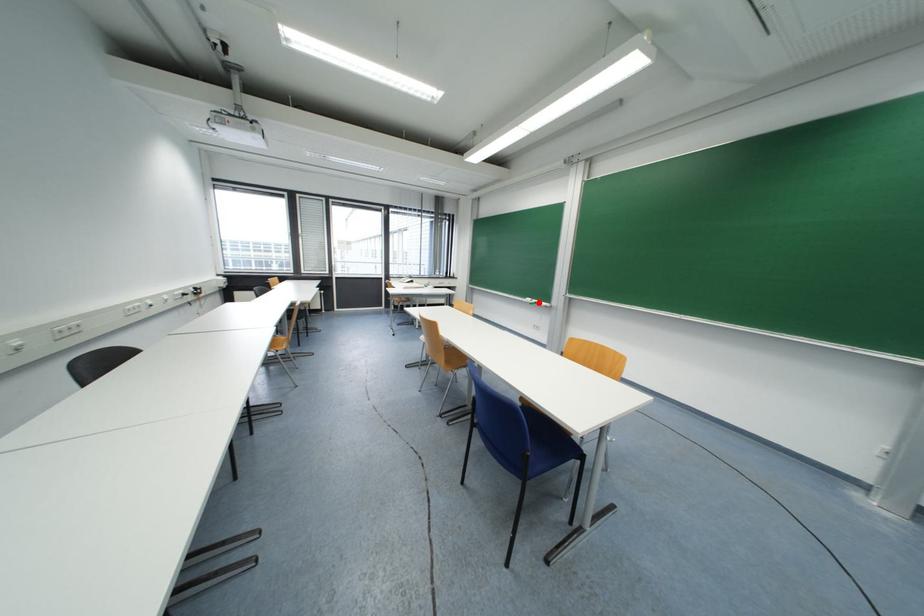
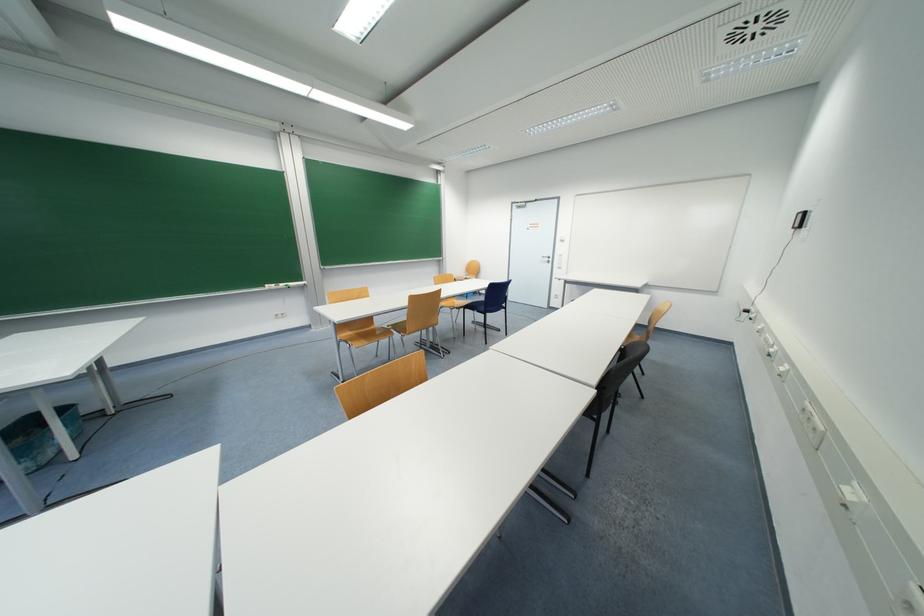
Question: I am providing you with two images of the same scene from different viewpoints. In image1, a red point is highlighted. Considering the same 3D point in image2, which of the following is correct?

Choices:
 (A) It is closer
 (B) It is farther

Answer: (A)